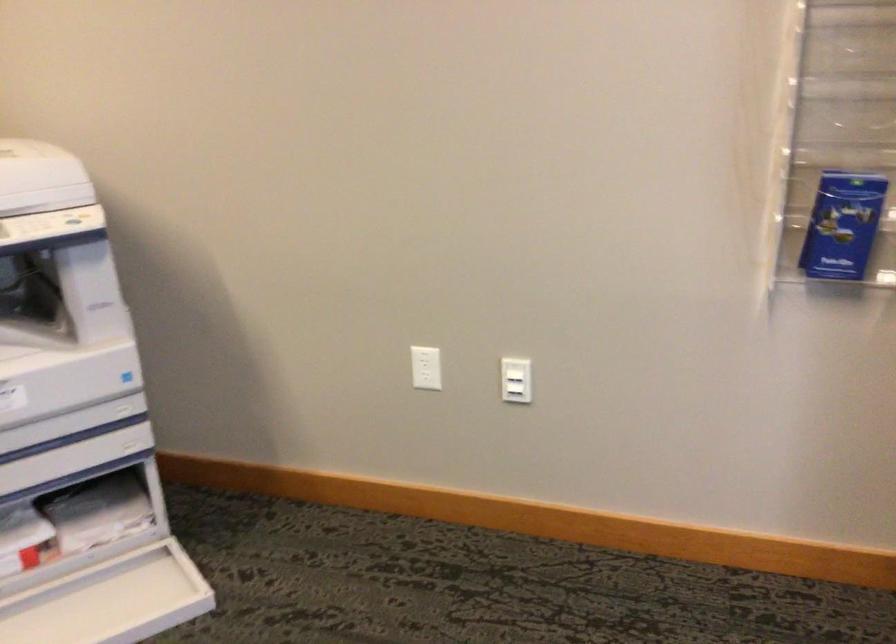
Where is `blue box`? blue box is located at coordinates (842, 225).